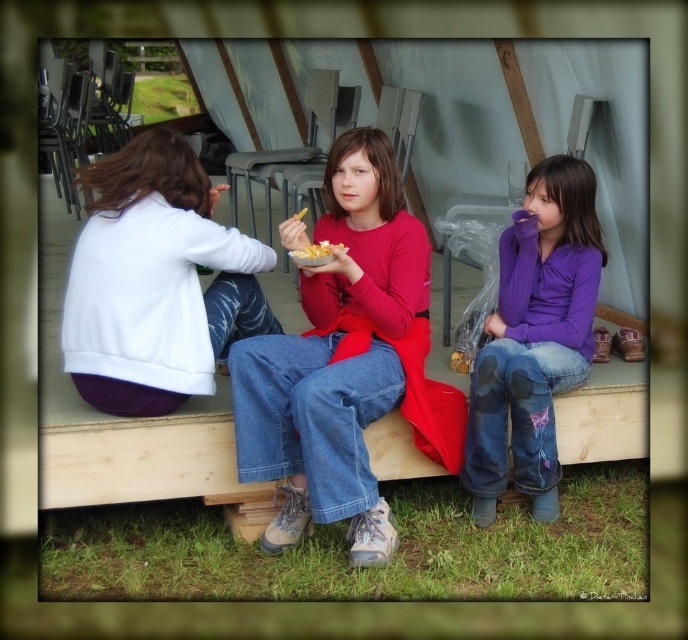
You are a photographer trying to capture a closeup of the yellow crispy snack at center. You notice the purple soft fabric shirt at center is blocking the view. Which object should you move to get a clear shot of the snack?

The purple soft fabric shirt at center is larger in size than the yellow crispy snack at center, so you should move the purple soft fabric shirt at center to get a clear shot of the yellow crispy snack at center.

You are standing 1.5 meters away from the wooden bench where the three girls are sitting. You want to throw a small ball to the point marked as point (158, 228). Will the ball land at that point if you throw it directly towards it?

The distance of point (158, 228) from viewer is 2.02 meters. Since you are standing 1.5 meters away from the wooden bench, you are closer than the point, so the ball will not land at that point if thrown directly towards it.

You are standing at the origin of a coordinate system where the image is represented. The point at coordinates (535, 339) is marked. Which object from the scene is located at this coordinate?

The point at coordinates (535, 339) indicates the purple soft fabric shirt at center.